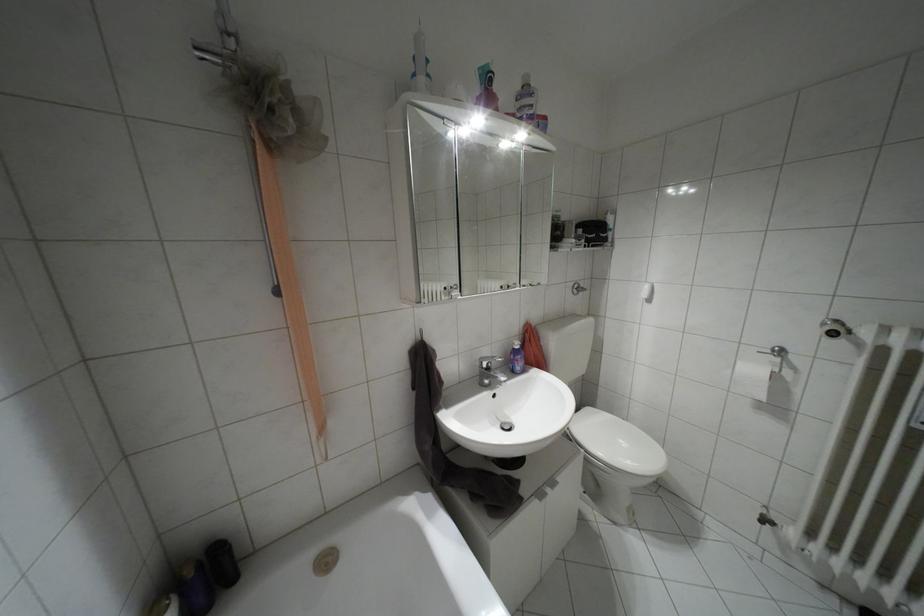
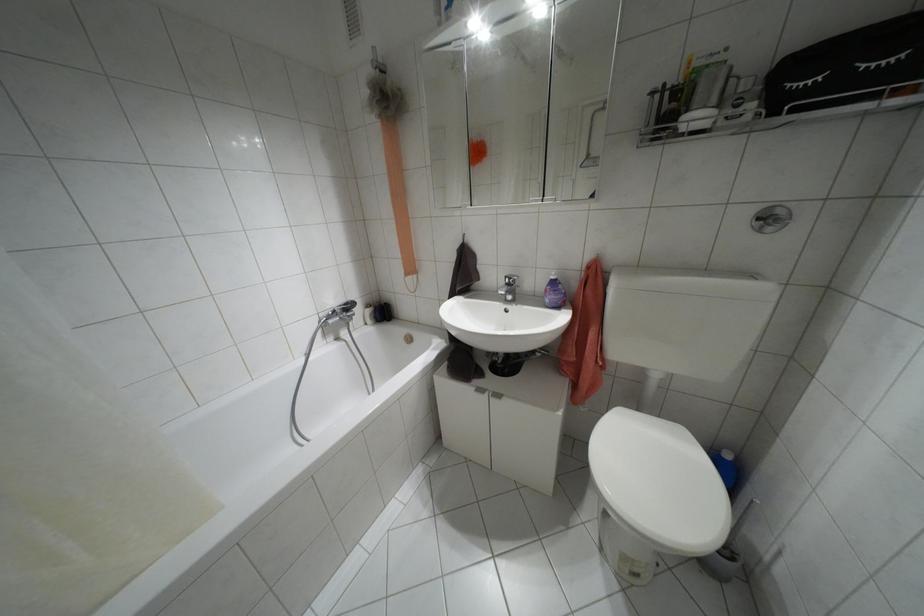
Find the pixel in the second image that matches point 517,346 in the first image.

(552, 277)